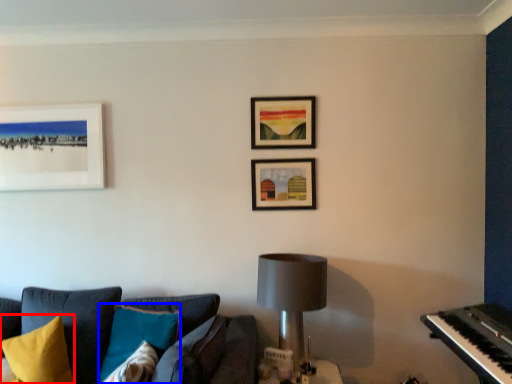
Question: Among these objects, which one is nearest to the camera, pillow (highlighted by a red box) or pillow (highlighted by a blue box)?

Choices:
 (A) pillow
 (B) pillow

Answer: (B)